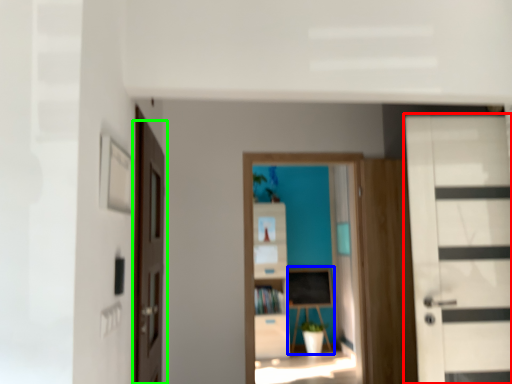
Question: Estimate the real-world distances between objects in this image. Which object is farther from door (highlighted by a red box), table (highlighted by a blue box) or door (highlighted by a green box)?

Choices:
 (A) table
 (B) door

Answer: (A)